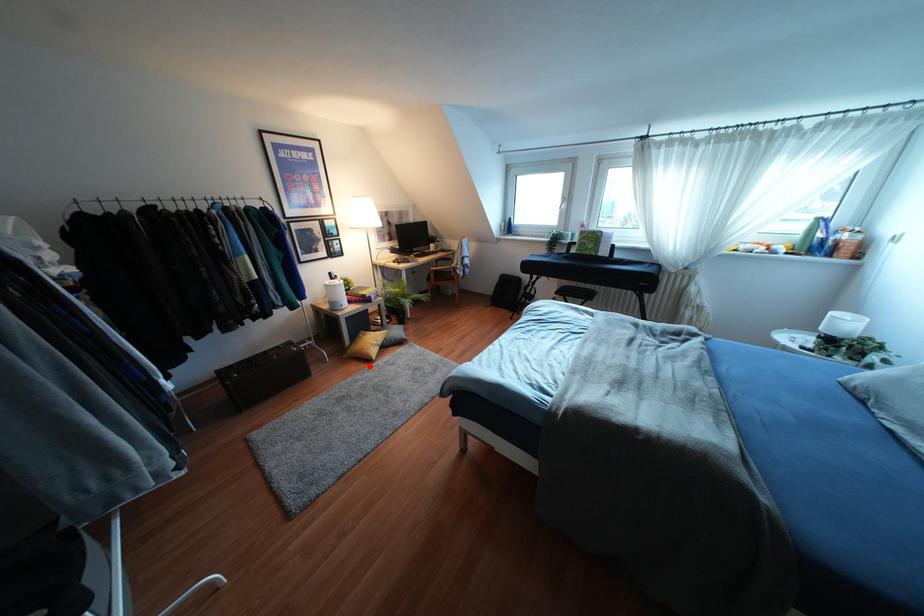
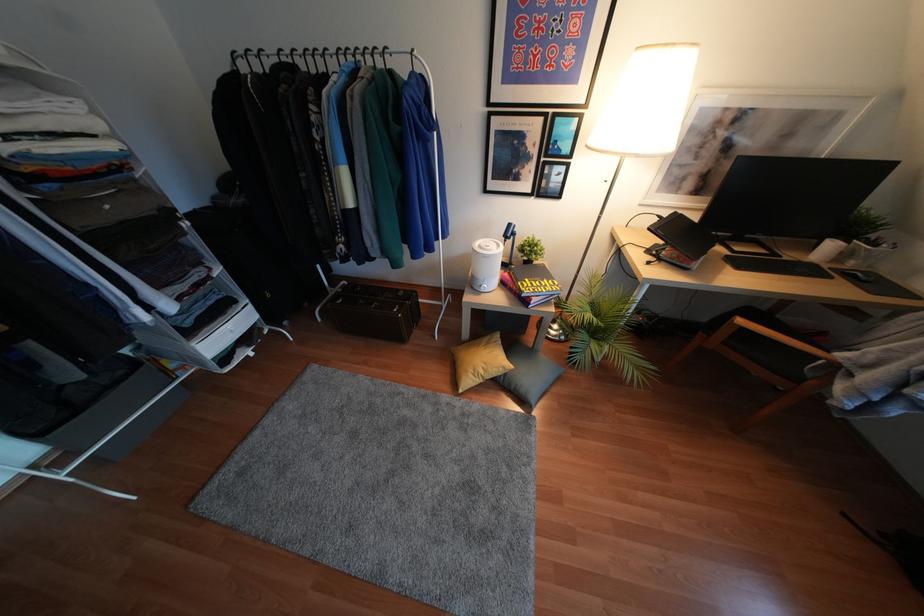
The point at the highlighted location is marked in the first image. Where is the corresponding point in the second image?

(445, 397)